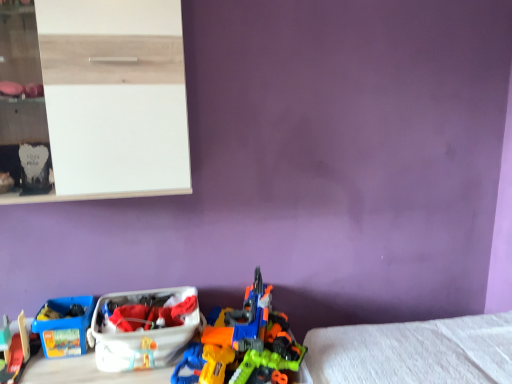
Find the location of `free location in front of blue plastic storage box at lower left, which is the 2th storage box in right-to-left order`. free location in front of blue plastic storage box at lower left, which is the 2th storage box in right-to-left order is located at coordinates (65, 369).